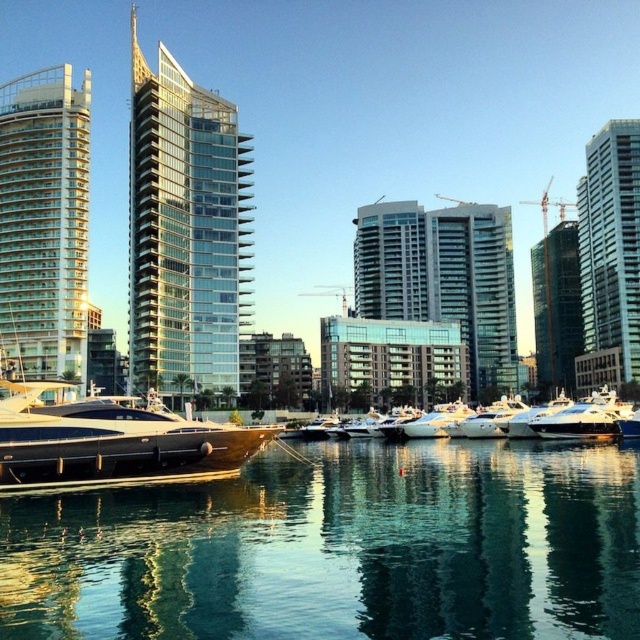
Is clear glass water at center to the right of white glass building at left from the viewer's perspective?

Yes, clear glass water at center is to the right of white glass building at left.

The image size is (640, 640). What do you see at coordinates (340, 548) in the screenshot? I see `clear glass water at center` at bounding box center [340, 548].

Image resolution: width=640 pixels, height=640 pixels. I want to click on clear glass water at center, so click(340, 548).

Can you confirm if clear glass water at center is thinner than glassy concrete building at center?

In fact, clear glass water at center might be wider than glassy concrete building at center.

Between clear glass water at center and glassy concrete building at center, which one is positioned higher?

glassy concrete building at center is higher up.

Describe the element at coordinates (340, 548) in the screenshot. I see `clear glass water at center` at that location.

Find the location of a particular element. clear glass water at center is located at coordinates (340, 548).

This screenshot has width=640, height=640. Describe the element at coordinates (442, 276) in the screenshot. I see `glassy concrete building at center` at that location.

This screenshot has height=640, width=640. I want to click on glassy concrete building at center, so click(x=442, y=276).

I want to click on glassy concrete building at center, so click(442, 276).